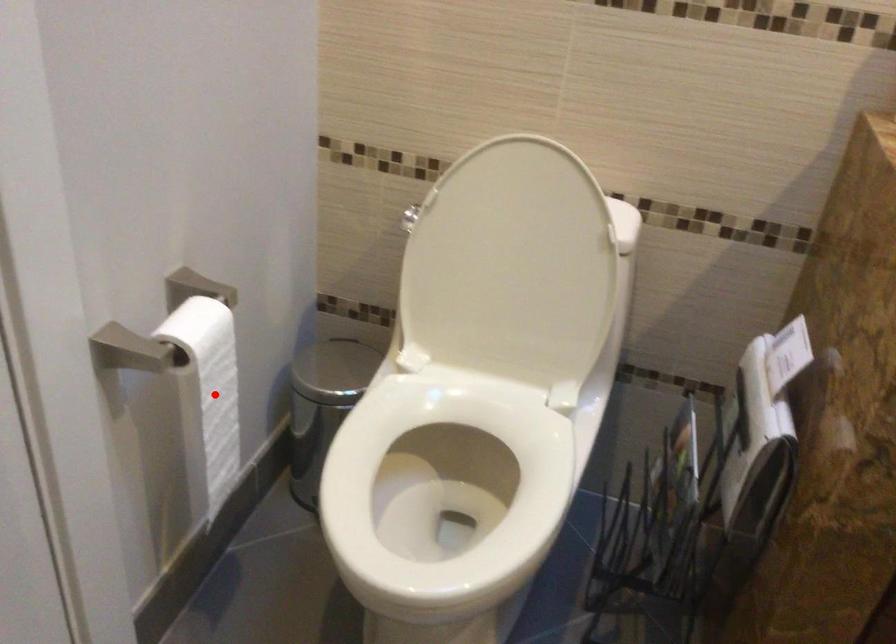
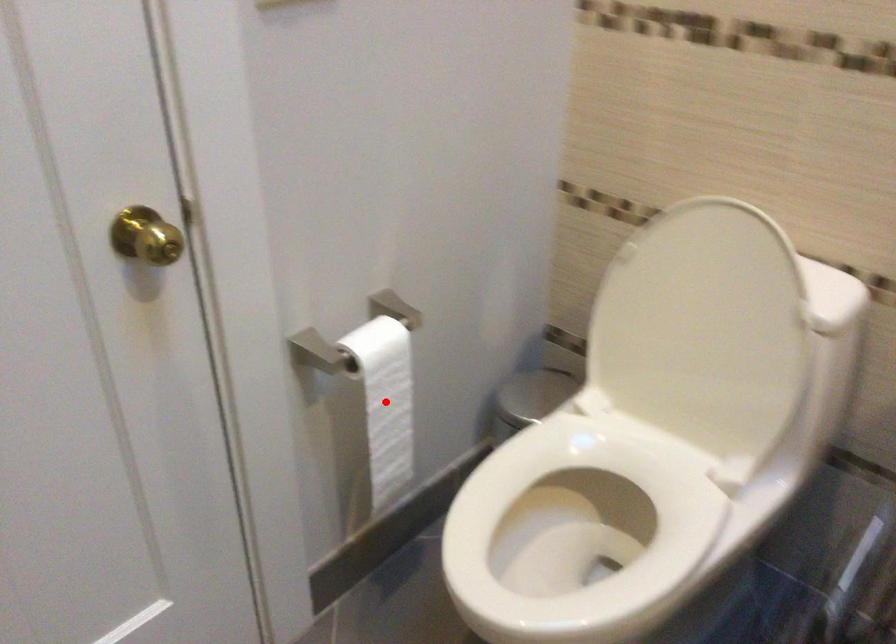
I am providing you with two images of the same scene from different viewpoints. A red point is marked on the first image and another point is marked on the second image. Does the point marked in image1 correspond to the same location as the one in image2?

Yes